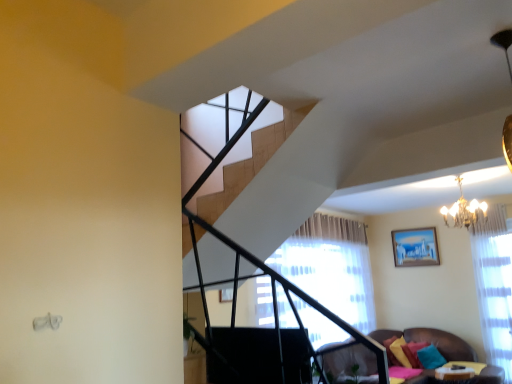
Question: Is matte blue painting at upper right inside teal fabric pillow at lower right, which is counted as the third pillow, starting from the left?

Choices:
 (A) no
 (B) yes

Answer: (A)

Question: Are teal fabric pillow at lower right, arranged as the 1th pillow when viewed from the right, and matte blue painting at upper right located far from each other?

Choices:
 (A) no
 (B) yes

Answer: (B)

Question: Is teal fabric pillow at lower right, arranged as the 1th pillow when viewed from the right, thinner than matte blue painting at upper right?

Choices:
 (A) no
 (B) yes

Answer: (A)

Question: Is teal fabric pillow at lower right, which is counted as the third pillow, starting from the left, positioned behind matte blue painting at upper right?

Choices:
 (A) yes
 (B) no

Answer: (B)

Question: From a real-world perspective, is teal fabric pillow at lower right, which is counted as the third pillow, starting from the left, physically above matte blue painting at upper right?

Choices:
 (A) no
 (B) yes

Answer: (A)

Question: Is teal fabric pillow at lower right, which appears as the second pillow when viewed from the left, wider or thinner than velvet brown couch at lower right?

Choices:
 (A) thin
 (B) wide

Answer: (A)

Question: From a real-world perspective, is teal fabric pillow at lower right, the 2th pillow in the right-to-left sequence, physically located above or below velvet brown couch at lower right?

Choices:
 (A) below
 (B) above

Answer: (A)

Question: Does point (425, 365) appear closer or farther from the camera than point (336, 352)?

Choices:
 (A) farther
 (B) closer

Answer: (A)

Question: Which is correct: teal fabric pillow at lower right, which appears as the second pillow when viewed from the left, is inside velvet brown couch at lower right, or outside of it?

Choices:
 (A) outside
 (B) inside

Answer: (A)

Question: From the image's perspective, relative to teal fabric pillow at lower right, which appears as the second pillow when viewed from the left, is matte blue painting at upper right above or below?

Choices:
 (A) below
 (B) above

Answer: (B)

Question: From a real-world perspective, relative to teal fabric pillow at lower right, the 2th pillow in the right-to-left sequence, is matte blue painting at upper right vertically above or below?

Choices:
 (A) above
 (B) below

Answer: (A)

Question: Looking at the image, does matte blue painting at upper right seem bigger or smaller compared to teal fabric pillow at lower right, which appears as the second pillow when viewed from the left?

Choices:
 (A) big
 (B) small

Answer: (A)

Question: Is point (417, 231) closer or farther from the camera than point (395, 340)?

Choices:
 (A) closer
 (B) farther

Answer: (B)

Question: Is matte blue painting at upper right inside the boundaries of velvet brown couch at lower right, or outside?

Choices:
 (A) inside
 (B) outside

Answer: (B)

Question: Would you say matte blue painting at upper right is to the left or to the right of velvet brown couch at lower right in the picture?

Choices:
 (A) right
 (B) left

Answer: (A)